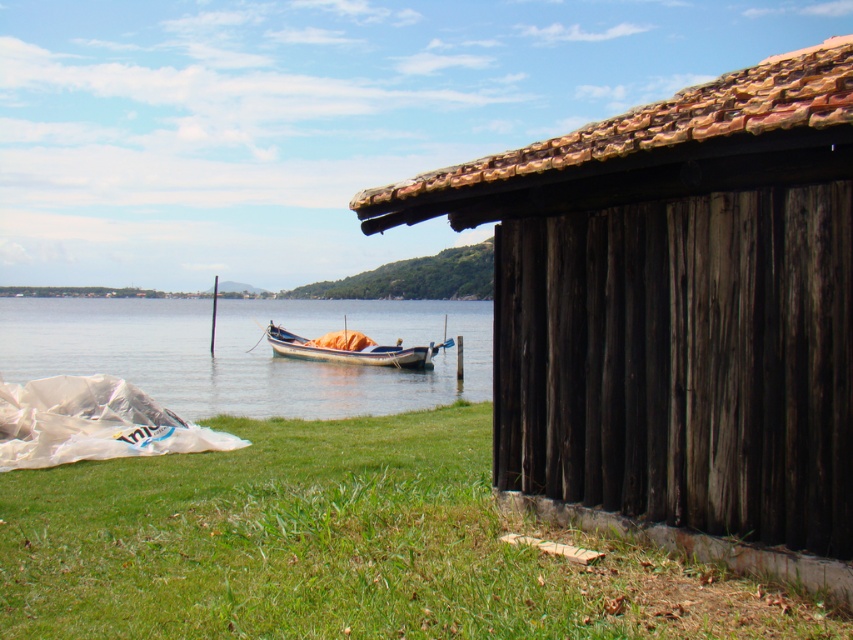
Describe the element at coordinates (677, 314) in the screenshot. I see `dark brown wooden hut at right` at that location.

Does dark brown wooden hut at right have a greater width compared to wooden boat at center?

No, dark brown wooden hut at right is not wider than wooden boat at center.

I want to click on dark brown wooden hut at right, so click(677, 314).

You are a GUI agent. You are given a task and a screenshot of the screen. Output one action in this format:
    pyautogui.click(x=<x>, y=<y>)
    Task: Click on the dark brown wooden hut at right
    Image resolution: width=853 pixels, height=640 pixels.
    Given the screenshot: What is the action you would take?
    pyautogui.click(x=677, y=314)

Who is lower down, green grass at lower center or clear water at boat left?

Positioned lower is green grass at lower center.

This screenshot has width=853, height=640. In order to click on green grass at lower center in this screenshot , I will do `click(343, 547)`.

Image resolution: width=853 pixels, height=640 pixels. I want to click on green grass at lower center, so click(343, 547).

Does dark brown wooden hut at right have a lesser height compared to green grass at lower center?

Incorrect, dark brown wooden hut at right's height does not fall short of green grass at lower center's.

Is the position of dark brown wooden hut at right more distant than that of green grass at lower center?

That is False.

Find the location of `dark brown wooden hut at right`. dark brown wooden hut at right is located at coordinates (677, 314).